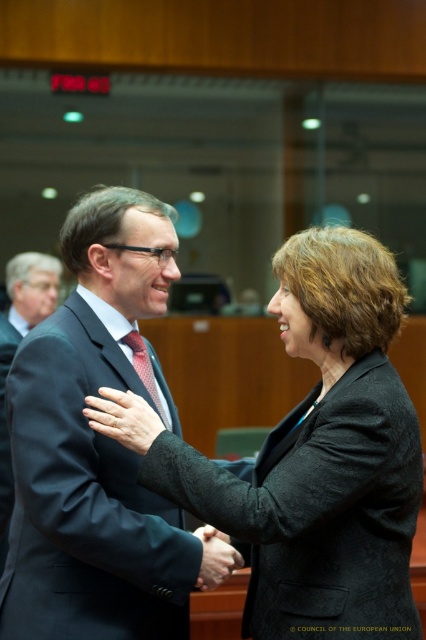
Does dark blue suit at center have a smaller size compared to black suit at center?

No, dark blue suit at center is not smaller than black suit at center.

Is dark blue suit at center positioned before black suit at center?

Yes, it is in front of black suit at center.

Is point (55, 348) farther from camera compared to point (40, 294)?

No, it is in front of (40, 294).

At what (x,y) coordinates should I click in order to perform the action: click on dark blue suit at center. Please return your answer as a coordinate pair (x, y). Looking at the image, I should click on (85, 500).

Who is positioned more to the right, black suit at center or matte black suit at center?

Positioned to the right is matte black suit at center.

Can you confirm if black suit at center is positioned to the right of matte black suit at center?

No, black suit at center is not to the right of matte black suit at center.

Does point (0, 426) lie behind point (137, 438)?

Yes, it is.

You are a GUI agent. You are given a task and a screenshot of the screen. Output one action in this format:
    pyautogui.click(x=<x>, y=<y>)
    Task: Click on the black suit at center
    The image size is (426, 640).
    Given the screenshot: What is the action you would take?
    pyautogui.click(x=17, y=348)

This screenshot has height=640, width=426. What do you see at coordinates (17, 348) in the screenshot?
I see `black suit at center` at bounding box center [17, 348].

Is point (6, 451) closer to viewer compared to point (209, 532)?

No, it is not.

Does point (28, 282) come behind point (198, 582)?

Yes, point (28, 282) is behind point (198, 582).

At what (x,y) coordinates should I click in order to perform the action: click on black suit at center. Please return your answer as a coordinate pair (x, y). Looking at the image, I should click on (17, 348).